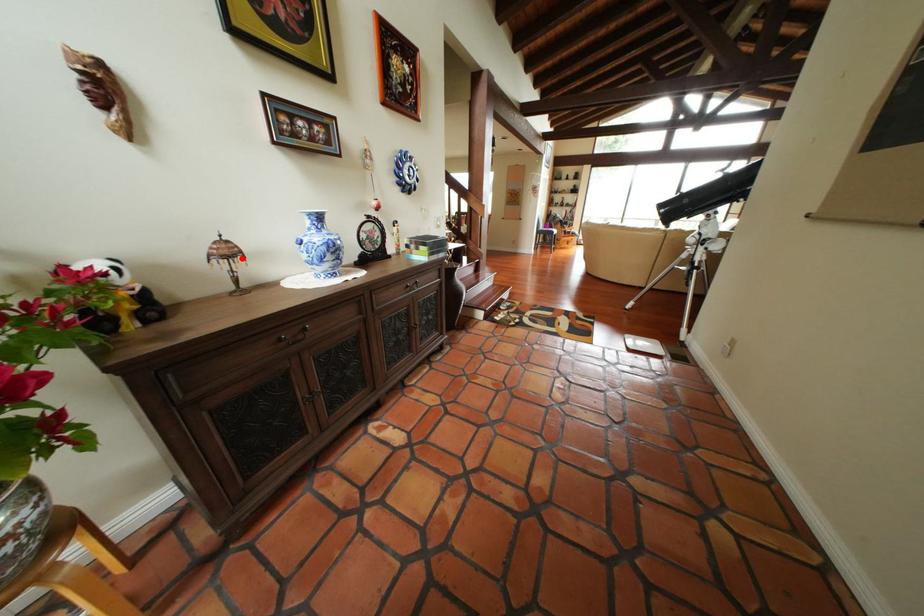
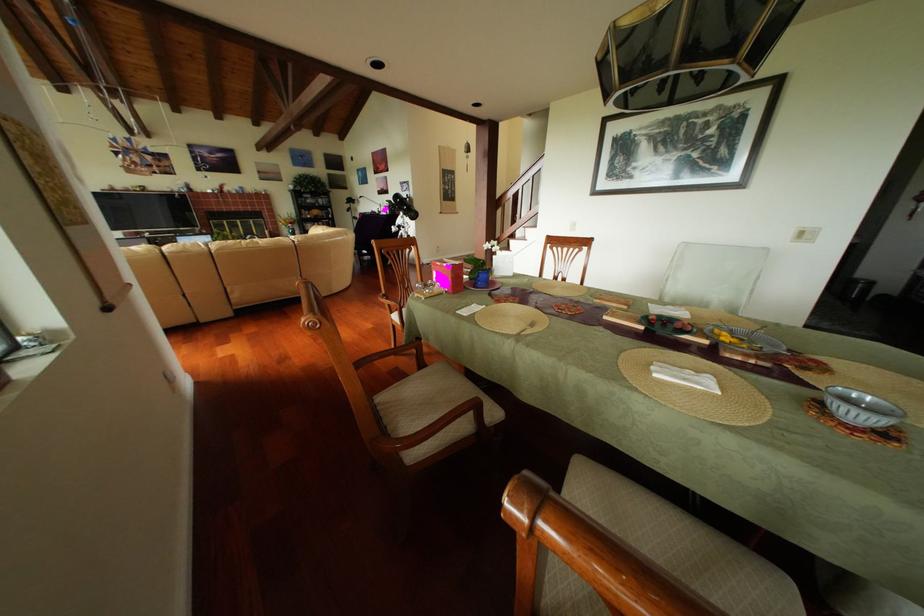
Question: I am providing you with two images of the same scene from different viewpoints. A red point is marked on the first image. At the location where the point appears in image 1, is it still visible in image 2?

Choices:
 (A) Yes
 (B) No

Answer: (B)